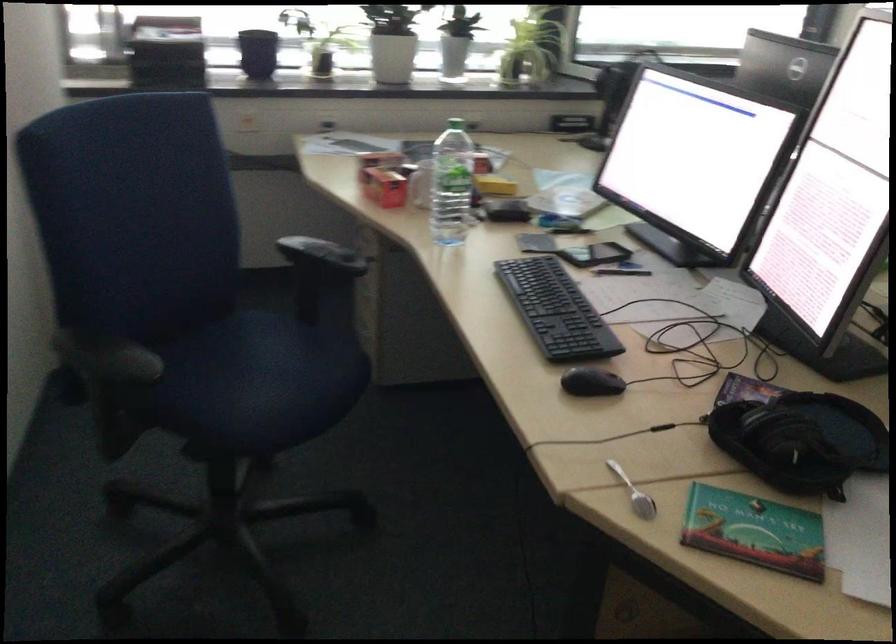
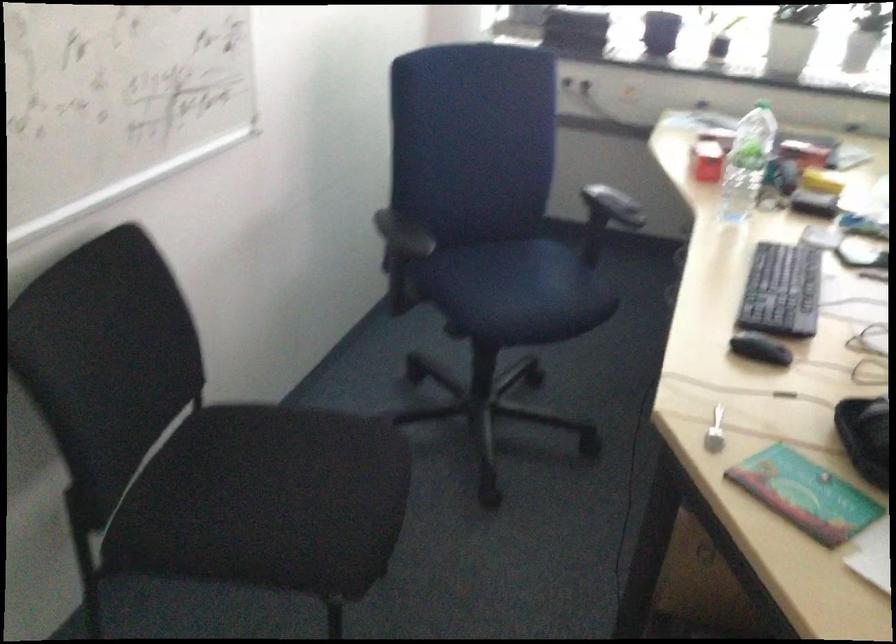
Question: The first image is from the beginning of the video and the second image is from the end. How did the camera likely rotate when shooting the video?

Choices:
 (A) Left
 (B) Right
 (C) Up
 (D) Down

Answer: (A)